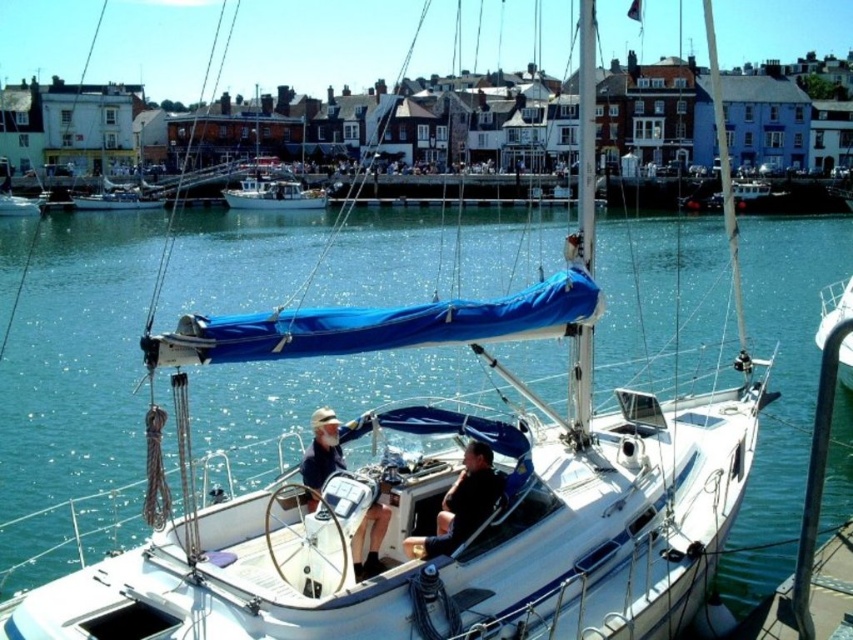
You are a marine biologist planning to place a buoy 1 meter away from the white sailboat at center. Given the coordinates provided, in which direction should you place the buoy to ensure it stays within the marina area depicted in the scene?

The white sailboat at center is located at point (271,189). To place the buoy 1 meter away within the marina area, you should place it in a direction that keeps it within the visible water area shown in the scene.